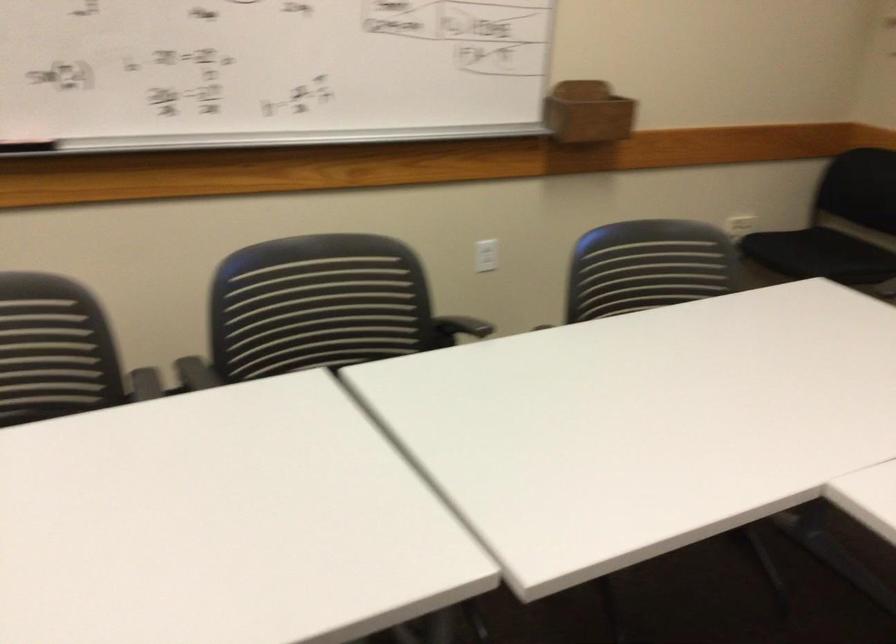
This screenshot has width=896, height=644. What do you see at coordinates (317, 308) in the screenshot?
I see `the chair sitting surface` at bounding box center [317, 308].